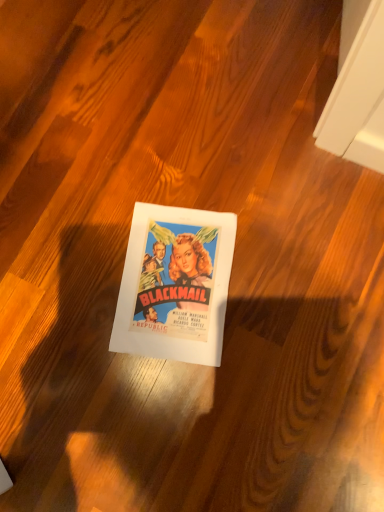
Identify the location of free spot below white paper poster at center (from a real-world perspective). This screenshot has height=512, width=384. (175, 282).